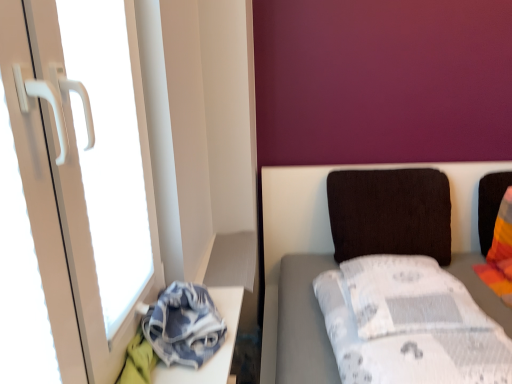
Describe the element at coordinates (216, 352) in the screenshot. I see `denim fabric at lower left` at that location.

The height and width of the screenshot is (384, 512). What do you see at coordinates (77, 184) in the screenshot?
I see `white plastic screen door at left` at bounding box center [77, 184].

In order to face white fabric bed at right, should I rotate leftwards or rightwards?

Turn right approximately 19.673 degrees to face it.

The image size is (512, 384). What are the coordinates of `denim fabric at lower left` in the screenshot? It's located at (216, 352).

Who is bigger, denim fabric at lower left or white plastic screen door at left?

white plastic screen door at left.

Is denim fabric at lower left aimed at white plastic screen door at left?

No, denim fabric at lower left is not turned towards white plastic screen door at left.

From the picture: From a real-world perspective, is denim fabric at lower left on top of white plastic screen door at left?

No.

Does point (222, 305) lie behind point (1, 1)?

Yes, it is behind point (1, 1).

Can you confirm if dark brown fabric pillow at center-right is shorter than white fabric bed at right?

Incorrect, the height of dark brown fabric pillow at center-right does not fall short of that of white fabric bed at right.

How different are the orientations of dark brown fabric pillow at center-right and white fabric bed at right in degrees?

1.48 degrees separate the facing orientations of dark brown fabric pillow at center-right and white fabric bed at right.

Between dark brown fabric pillow at center-right and white fabric bed at right, which one has smaller width?

dark brown fabric pillow at center-right.

Is dark brown fabric pillow at center-right inside the boundaries of white fabric bed at right, or outside?

dark brown fabric pillow at center-right lies outside white fabric bed at right.

Can you confirm if denim fabric at lower left is taller than white fabric bed at right?

Incorrect, the height of denim fabric at lower left is not larger of that of white fabric bed at right.

Is denim fabric at lower left thinner than white fabric bed at right?

Yes.

Considering the points (227, 372) and (322, 286), which point is behind, point (227, 372) or point (322, 286)?

The point (322, 286) is farther.

Is dark brown fabric pillow at center-right at the back of denim fabric at lower left?

That's not correct — denim fabric at lower left is not looking away from dark brown fabric pillow at center-right.

Between denim fabric at lower left and dark brown fabric pillow at center-right, which one has smaller size?

Smaller between the two is denim fabric at lower left.

Is denim fabric at lower left far away from dark brown fabric pillow at center-right?

No, denim fabric at lower left is not far from dark brown fabric pillow at center-right.

From the image's perspective, which object appears higher, white fabric bed at right or white plastic screen door at left?

white plastic screen door at left.

Considering the positions of objects white fabric bed at right and white plastic screen door at left in the image provided, who is more to the left, white fabric bed at right or white plastic screen door at left?

From the viewer's perspective, white plastic screen door at left appears more on the left side.

I want to click on furniture below the white plastic screen door at left (from a real-world perspective), so click(361, 339).

Which of these two, white fabric bed at right or white plastic screen door at left, stands taller?

white plastic screen door at left is taller.

Is white plastic screen door at left turned away from denim fabric at lower left?

No, white plastic screen door at left is not facing the opposite direction of denim fabric at lower left.

Is white plastic screen door at left in contact with denim fabric at lower left?

No, white plastic screen door at left is not making contact with denim fabric at lower left.

Does white fabric bed at right turn towards dark brown fabric pillow at center-right?

No.

Measure the distance between white fabric bed at right and dark brown fabric pillow at center-right.

white fabric bed at right is 26.16 centimeters away from dark brown fabric pillow at center-right.

From the image's perspective, which one is positioned lower, white fabric bed at right or dark brown fabric pillow at center-right?

white fabric bed at right appears lower in the image.

Looking at this image, can you confirm if white fabric bed at right is bigger than dark brown fabric pillow at center-right?

Yes.

Locate an element on the screen. table behind the white plastic screen door at left is located at coordinates (216, 352).

The width and height of the screenshot is (512, 384). I want to click on furniture below the dark brown fabric pillow at center-right (from a real-world perspective), so click(x=361, y=339).

Estimate the real-world distances between objects in this image. Which object is closer to denim fabric at lower left, dark brown fabric pillow at center-right or white plastic screen door at left?

Based on the image, white plastic screen door at left appears to be nearer to denim fabric at lower left.

From the image, which object appears to be nearer to dark brown fabric pillow at center-right, denim fabric at lower left or white fabric bed at right?

white fabric bed at right.

From the image, which object appears to be farther from dark brown fabric pillow at center-right, white fabric bed at right or white plastic screen door at left?

white plastic screen door at left is positioned further to the anchor dark brown fabric pillow at center-right.

Estimate the real-world distances between objects in this image. Which object is closer to white plastic screen door at left, dark brown fabric pillow at center-right or white fabric bed at right?

white fabric bed at right lies closer to white plastic screen door at left than the other object.

When comparing their distances from denim fabric at lower left, does white plastic screen door at left or dark brown fabric pillow at center-right seem closer?

white plastic screen door at left.

Based on their spatial positions, is dark brown fabric pillow at center-right or denim fabric at lower left closer to white fabric bed at right?

Based on the image, dark brown fabric pillow at center-right appears to be nearer to white fabric bed at right.

From the image, which object appears to be farther from white fabric bed at right, denim fabric at lower left or dark brown fabric pillow at center-right?

The object further to white fabric bed at right is denim fabric at lower left.

When comparing their distances from white fabric bed at right, does dark brown fabric pillow at center-right or white plastic screen door at left seem further?

Based on the image, white plastic screen door at left appears to be further to white fabric bed at right.

Locate an element on the screen. The width and height of the screenshot is (512, 384). table positioned between white plastic screen door at left and dark brown fabric pillow at center-right from near to far is located at coordinates (216, 352).

Find the location of a particular element. The width and height of the screenshot is (512, 384). table between white plastic screen door at left and white fabric bed at right in the horizontal direction is located at coordinates (216, 352).

The height and width of the screenshot is (384, 512). What are the coordinates of `furniture between white plastic screen door at left and dark brown fabric pillow at center-right along the z-axis` in the screenshot? It's located at (361, 339).

Where is `table located between white fabric bed at right and dark brown fabric pillow at center-right in the depth direction`? table located between white fabric bed at right and dark brown fabric pillow at center-right in the depth direction is located at coordinates (216, 352).